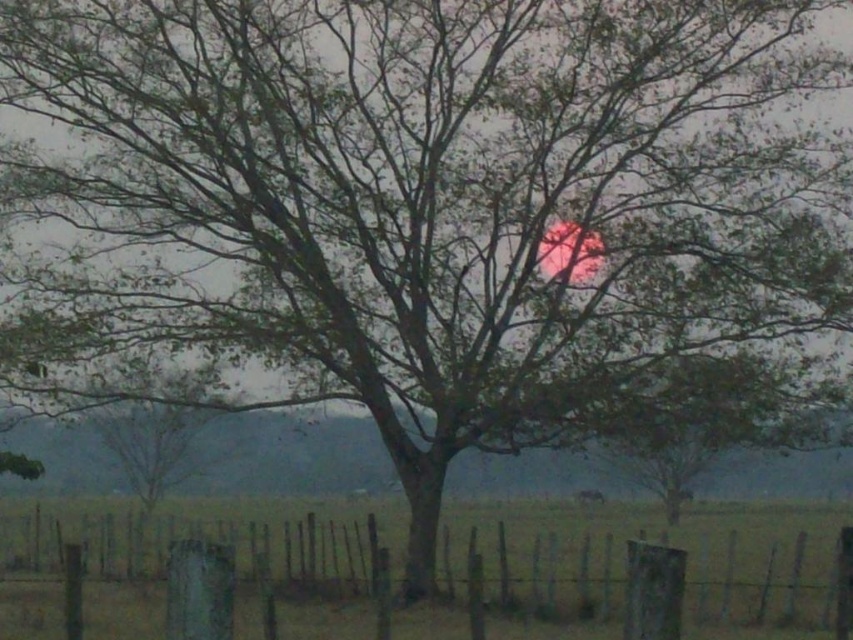
Question: Does wooden post fence at lower center appear over green matte tree at center?

Choices:
 (A) no
 (B) yes

Answer: (A)

Question: Can you confirm if wooden post fence at lower center is positioned to the left of green matte tree at center?

Choices:
 (A) yes
 (B) no

Answer: (B)

Question: Can you confirm if wooden post fence at lower center is wider than green matte tree at center?

Choices:
 (A) yes
 (B) no

Answer: (A)

Question: Which of the following is the closest to the observer?

Choices:
 (A) green matte tree at center
 (B) wooden post fence at lower center

Answer: (B)

Question: Which point is closer to the camera?

Choices:
 (A) (160, 472)
 (B) (792, 548)

Answer: (B)